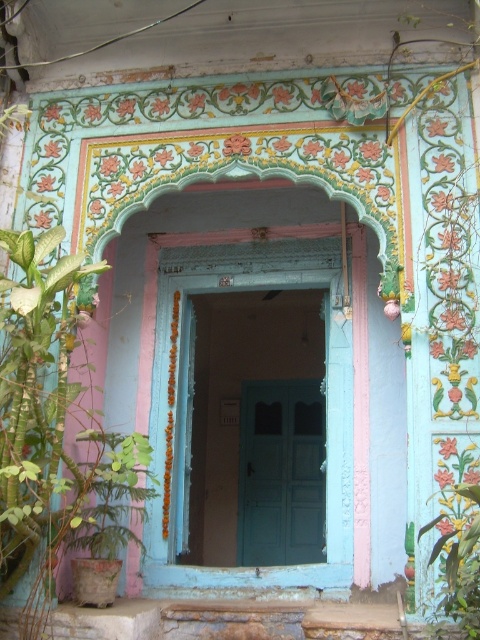
Question: Is green leafy plant at left thinner than teal matte door at center?

Choices:
 (A) no
 (B) yes

Answer: (A)

Question: Among these objects, which one is farthest from the camera?

Choices:
 (A) teal matte door at center
 (B) green leafy plant at left

Answer: (A)

Question: Does green leafy plant at left appear over green leafy plant at lower right?

Choices:
 (A) yes
 (B) no

Answer: (A)

Question: Which is farther from the green leafy plant at left?

Choices:
 (A) green leafy plant at lower right
 (B) teal painted door at center
 (C) teal matte door at center

Answer: (C)

Question: From the image, what is the correct spatial relationship of teal painted door at center in relation to green leafy plant at left?

Choices:
 (A) below
 (B) above

Answer: (A)

Question: Among these points, which one is nearest to the camera?

Choices:
 (A) (43, 490)
 (B) (466, 564)
 (C) (163, 460)

Answer: (B)